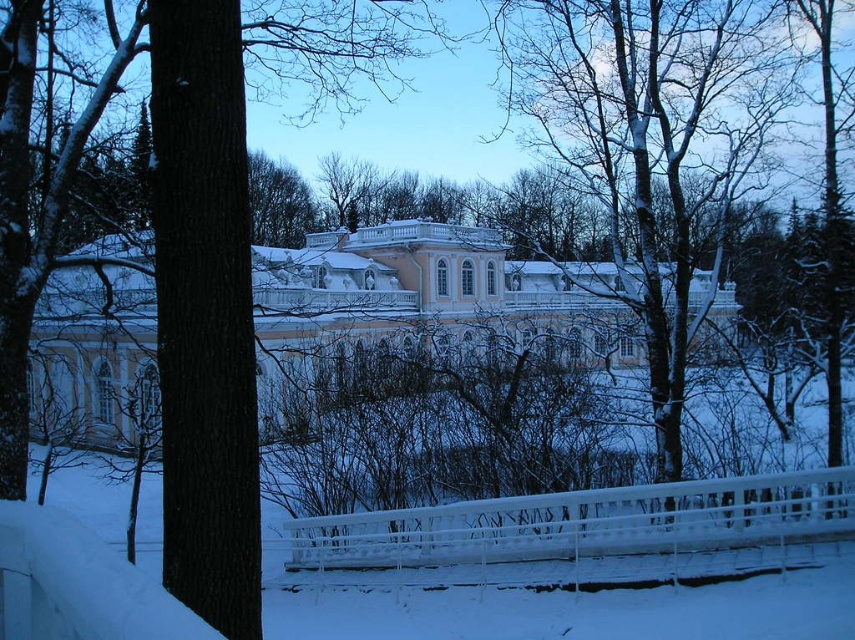
Question: Is white glossy palace at center bigger than smooth bark tree at center?

Choices:
 (A) yes
 (B) no

Answer: (A)

Question: Which point is closer to the camera?

Choices:
 (A) white glossy palace at center
 (B) smooth bark tree at center

Answer: (B)

Question: Which object appears farthest from the camera in this image?

Choices:
 (A) white glossy palace at center
 (B) smooth bark tree at center

Answer: (A)

Question: Is white glossy palace at center smaller than smooth bark tree at center?

Choices:
 (A) yes
 (B) no

Answer: (B)

Question: In this image, where is white glossy palace at center located relative to smooth bark tree at center?

Choices:
 (A) right
 (B) left

Answer: (B)